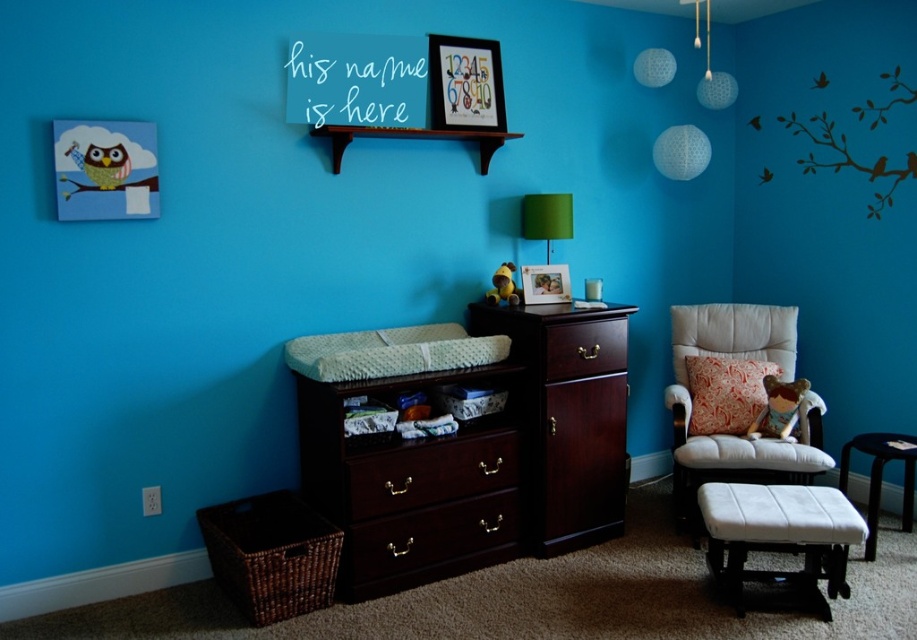
Is mahogany wood dresser at center closer to the viewer compared to white leather armchair at right?

Yes, mahogany wood dresser at center is closer to the viewer.

Who is higher up, mahogany wood dresser at center or white leather armchair at right?

white leather armchair at right

This screenshot has height=640, width=917. What do you see at coordinates (478, 456) in the screenshot? I see `mahogany wood dresser at center` at bounding box center [478, 456].

Identify the location of mahogany wood dresser at center. This screenshot has height=640, width=917. (478, 456).

In the scene shown: Between dark wood drawer at center and floral fabric pillow at right, which one appears on the left side from the viewer's perspective?

dark wood drawer at center

Where is `dark wood drawer at center`? This screenshot has width=917, height=640. dark wood drawer at center is located at coordinates (429, 538).

Find the location of a particular element. Image resolution: width=917 pixels, height=640 pixels. dark wood drawer at center is located at coordinates (429, 538).

Is white leather armchair at right closer to camera compared to white fabric stool at lower right?

No, it is not.

Describe the element at coordinates (732, 435) in the screenshot. The image size is (917, 640). I see `white leather armchair at right` at that location.

The height and width of the screenshot is (640, 917). Identify the location of white leather armchair at right. (732, 435).